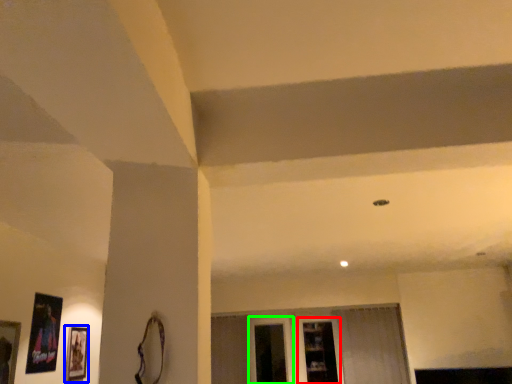
Question: Which is nearer to the shelf (highlighted by a red box)? picture frame (highlighted by a blue box) or window (highlighted by a green box).

Choices:
 (A) picture frame
 (B) window

Answer: (B)